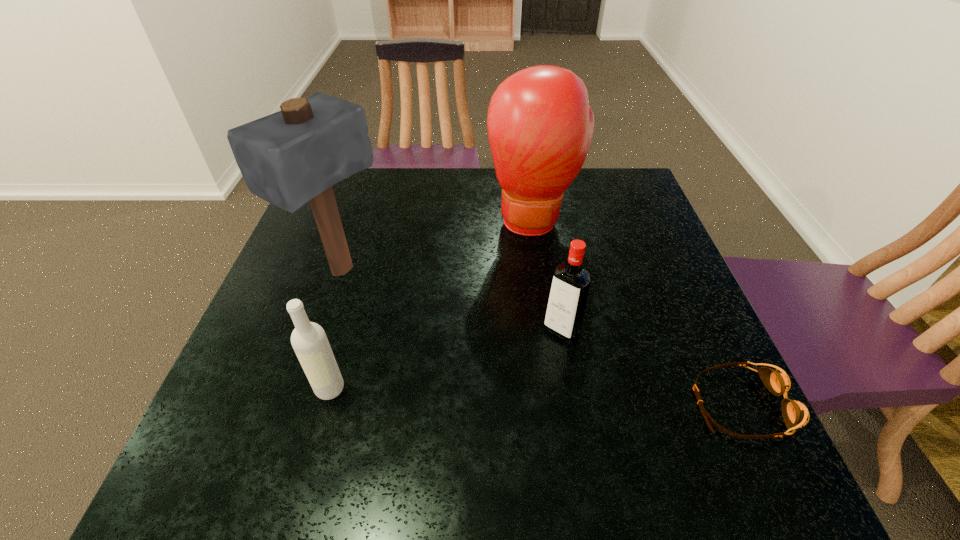
This screenshot has width=960, height=540. In order to click on object present at the left edge in this screenshot , I will do `click(294, 156)`.

This screenshot has height=540, width=960. In order to click on object that is at the right edge in this screenshot , I will do `click(795, 414)`.

This screenshot has width=960, height=540. Identify the location of object that is at the near right corner. (795, 414).

The width and height of the screenshot is (960, 540). Find the location of `vacant space at the far edge`. vacant space at the far edge is located at coordinates (494, 207).

The width and height of the screenshot is (960, 540). I want to click on free space at the near edge, so (500, 428).

At what (x,y) coordinates should I click in order to perform the action: click on vacant space at the left edge of the desktop. Please return your answer as a coordinate pair (x, y). The width and height of the screenshot is (960, 540). Looking at the image, I should click on (278, 349).

The image size is (960, 540). What are the coordinates of `free space at the right edge of the desktop` in the screenshot? It's located at (614, 246).

Image resolution: width=960 pixels, height=540 pixels. I want to click on blank space at the far left corner of the desktop, so click(360, 174).

In order to click on vacant region at the near left corner of the desktop in this screenshot , I will do `click(289, 412)`.

Image resolution: width=960 pixels, height=540 pixels. In the image, there is a desktop. Identify the location of free region at the far right corner. (602, 169).